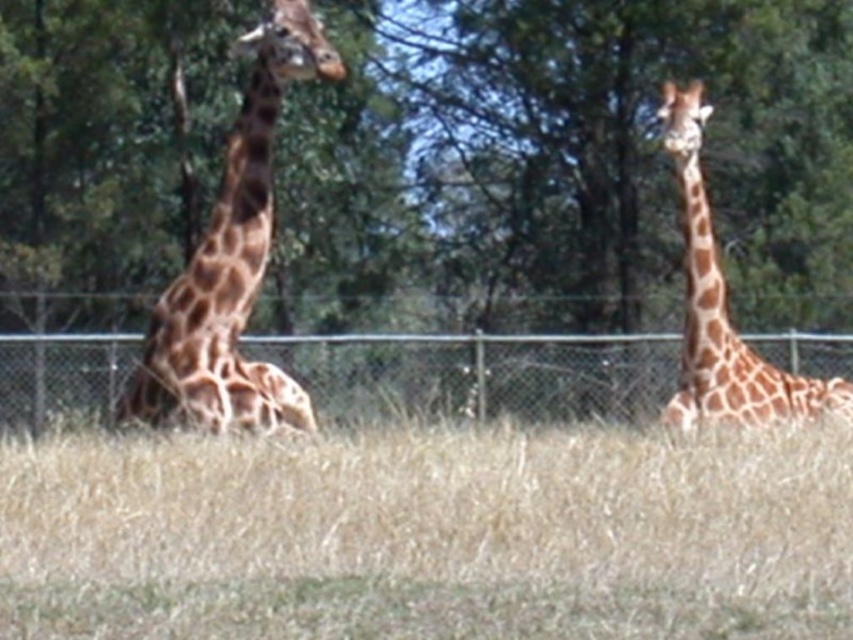
You are a zookeeper standing at the entrance of the giraffe enclosure. You notice two points marked on the ground at coordinates point (x=320, y=595) and point (x=135, y=380). Which point is closer to you?

Point (x=320, y=595) is in front of point (x=135, y=380), so it is closer to you.